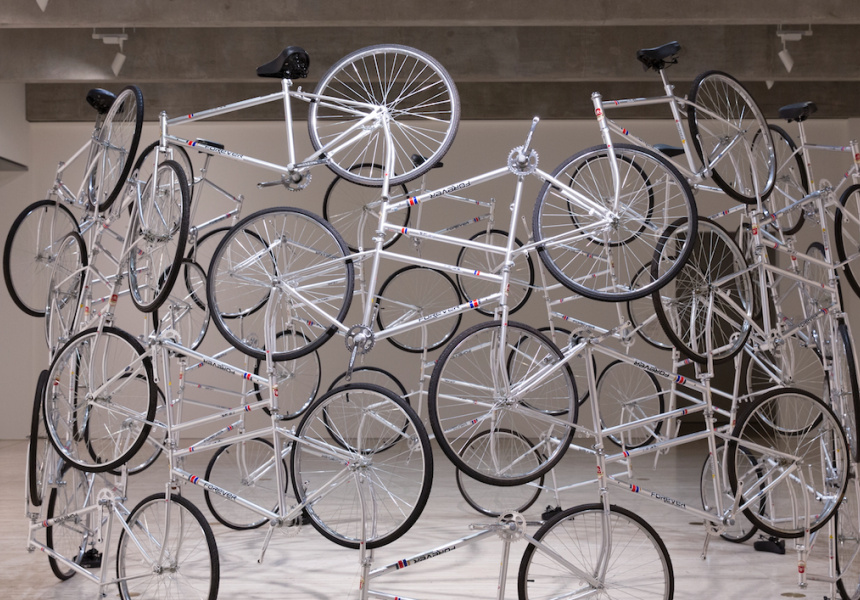
You are a GUI agent. You are given a task and a screenshot of the screen. Output one action in this format:
    pyautogui.click(x=<x>, y=<y>)
    Task: Click on the door
    
    Given the screenshot: What is the action you would take?
    pyautogui.click(x=723, y=377)